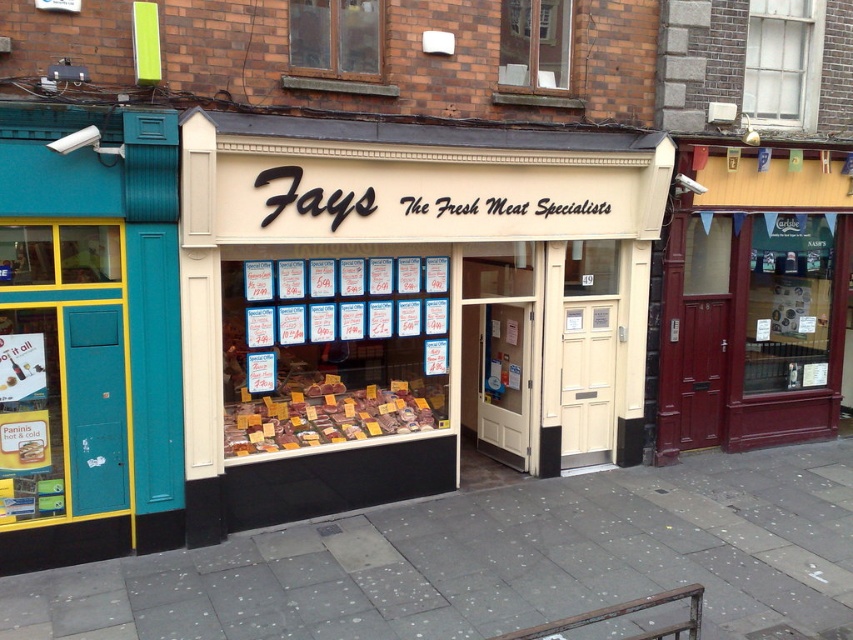
You are a customer standing in front of the shop. You notice the gray concrete pavement at center and the meat with yellow labels at center. Which one takes up more space in the image?

The meat with yellow labels at center occupies more space than the gray concrete pavement at center.

You are a customer standing in front of the shop entrance. You see the gray concrete pavement at center and the meat with yellow labels at center. Which object is located below the other?

The gray concrete pavement at center is positioned under meat with yellow labels at center, meaning the pavement is below the meat labels.

In the scene shown: You are a customer standing outside the shop and want to enter. Which object is closer to you as you approach the open door? The gray concrete pavement at center or the meat with yellow labels at center?

The gray concrete pavement at center is closer to you because it is in front of the meat with yellow labels at center, meaning the pavement is nearer to the open door where you are standing.